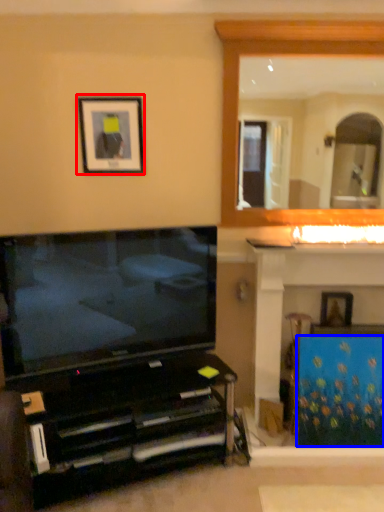
Question: Which point is closer to the camera, picture frame (highlighted by a red box) or curtain (highlighted by a blue box)?

Choices:
 (A) picture frame
 (B) curtain

Answer: (B)